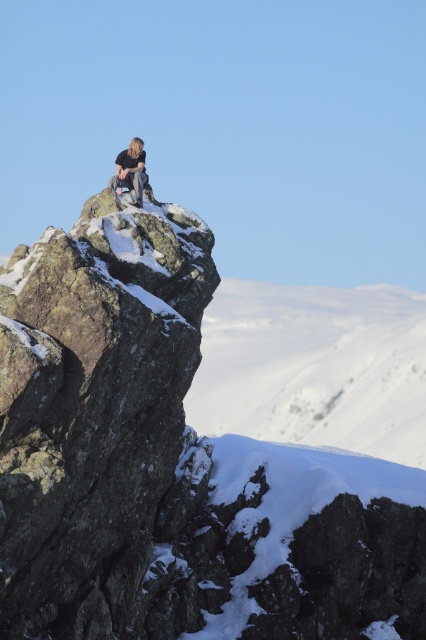
You are a photographer planning to take a picture of the rocky cliff at upper center and the light brown hair at upper center. Which object should you focus on first if you want to capture both in a single frame without moving the camera?

The rocky cliff at upper center is much taller than the light brown hair at upper center, so you should focus on the rocky cliff at upper center first to ensure it fits within the frame.

From the picture: You are standing at the base of the rocky outcrop and want to reach the highest point to join the person. There are two paths marked by coordinates point (279, 547) and point (143, 180). Which path is closer to you and safer to climb?

Point (279, 547) is further to the viewer than point (143, 180), so the path marked by point (143, 180) is closer and safer to climb.